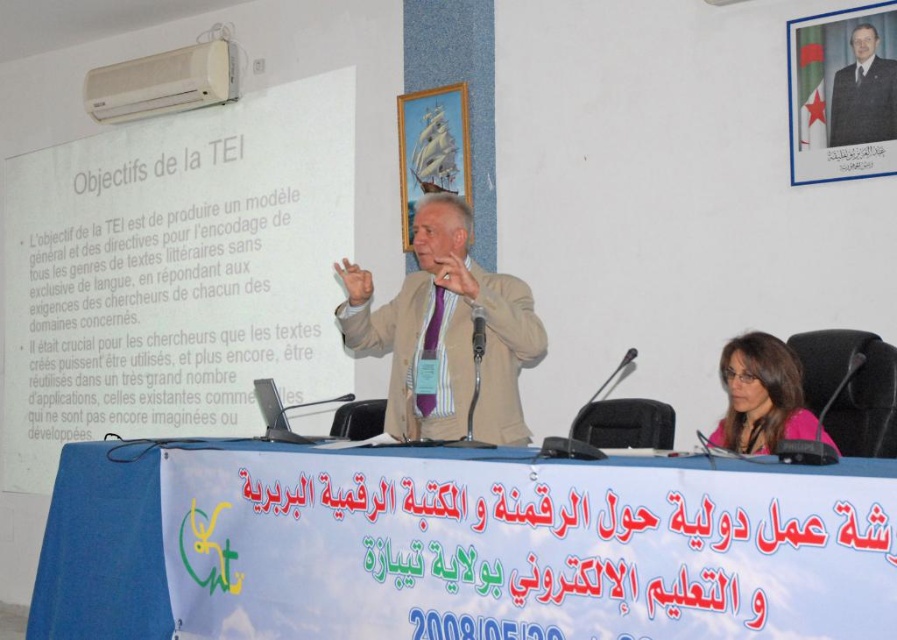
Measure the distance between white paper at upper center and formal black suit at upper right.

They are 10.07 feet apart.

Is point (244, 408) more distant than point (835, 76)?

Yes.

Find the location of a particular element. white paper at upper center is located at coordinates (175, 273).

This screenshot has width=897, height=640. I want to click on blue fabric banner at lower center, so click(454, 544).

At what (x,y) coordinates should I click in order to perform the action: click on blue fabric banner at lower center. Please return your answer as a coordinate pair (x, y). The height and width of the screenshot is (640, 897). Looking at the image, I should click on (454, 544).

Between point (457, 406) and point (873, 115), which one is positioned behind?

Positioned behind is point (873, 115).

Between beige fabric suit at center and formal black suit at upper right, which one has more height?

With more height is beige fabric suit at center.

Find the location of `beige fabric suit at center`. beige fabric suit at center is located at coordinates (445, 333).

This screenshot has height=640, width=897. I want to click on beige fabric suit at center, so click(x=445, y=333).